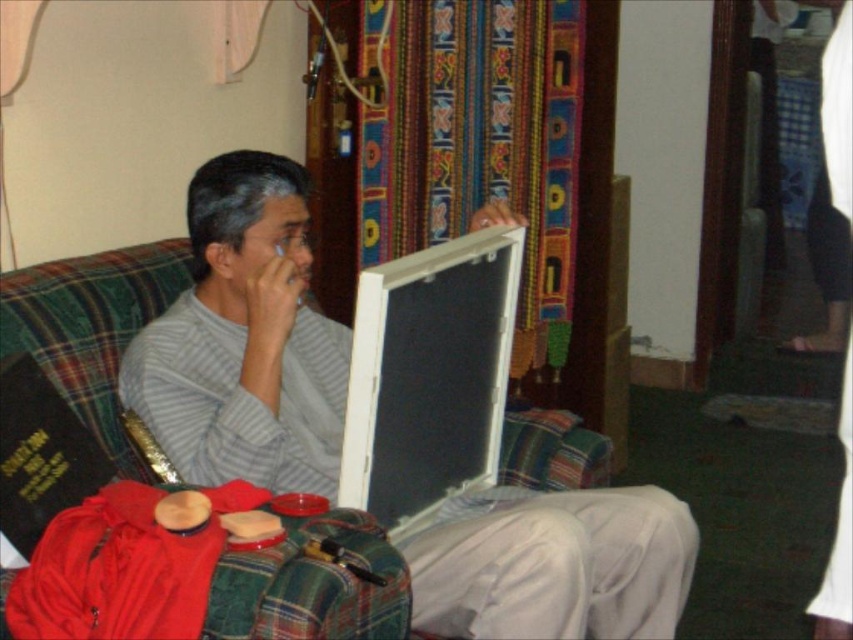
The height and width of the screenshot is (640, 853). What are the coordinates of `gray striped shirt at center` in the screenshot? It's located at (244, 339).

Does gray striped shirt at center have a greater width compared to white plastic laptop at center?

Indeed, gray striped shirt at center has a greater width compared to white plastic laptop at center.

Image resolution: width=853 pixels, height=640 pixels. I want to click on gray striped shirt at center, so click(244, 339).